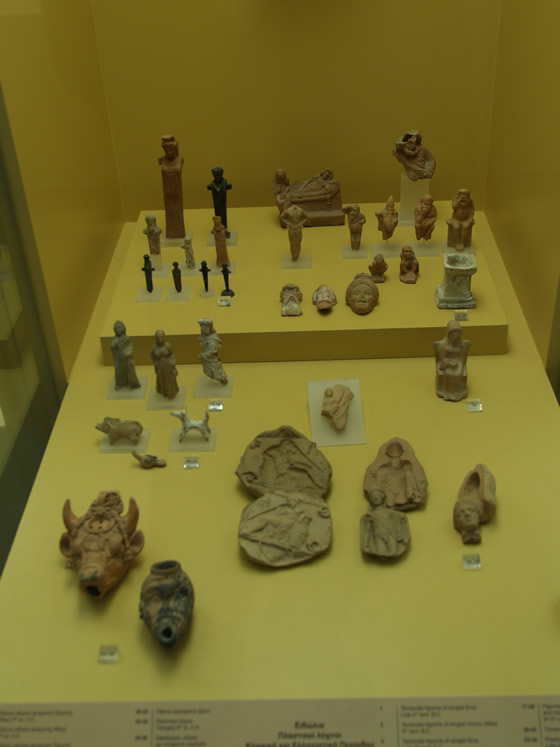
This screenshot has height=747, width=560. Find the location of `table`. table is located at coordinates (426, 589).